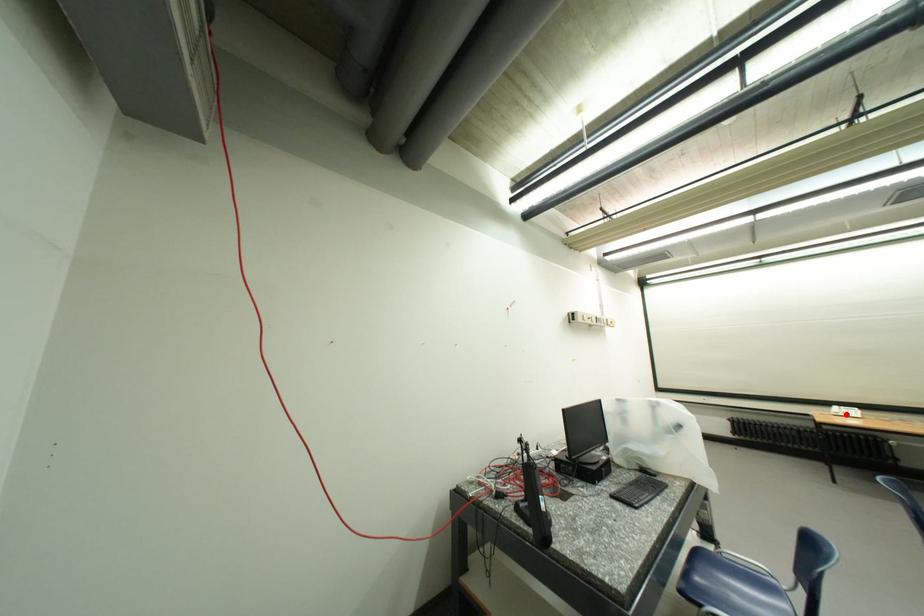
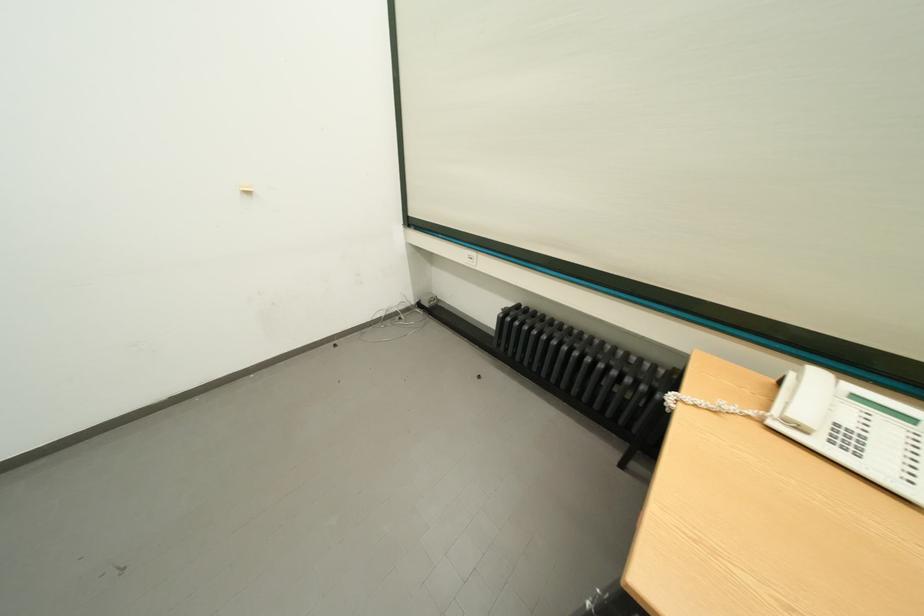
In the second image, find the point that corresponds to the highlighted location in the first image.

(809, 430)